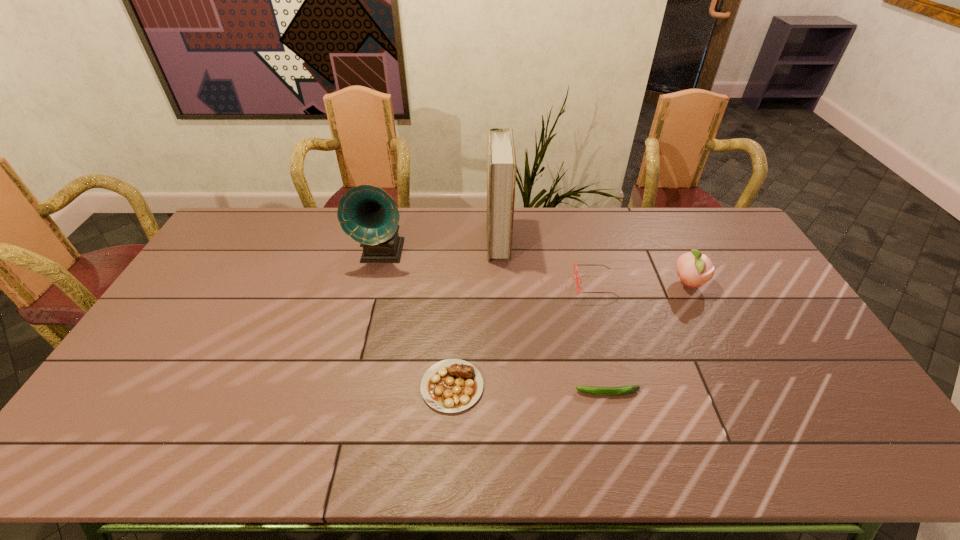
I want to click on vacant space located on the cover of the fourth object from right to left, so click(x=385, y=240).

Find the location of `blank area located on the cover of the fourth object from right to left`. blank area located on the cover of the fourth object from right to left is located at coordinates (407, 240).

At what (x,y) coordinates should I click in order to perform the action: click on blank space located 0.130m on the cover of the fourth object from right to left. Please return your answer as a coordinate pair (x, y). Looking at the image, I should click on point(451,240).

At what (x,y) coordinates should I click in order to perform the action: click on vacant space located 0.360m from the horn of the fifth shortest object. Please return your answer as a coordinate pair (x, y). The height and width of the screenshot is (540, 960). Looking at the image, I should click on (355, 362).

Locate an element on the screen. Image resolution: width=960 pixels, height=540 pixels. free space located on the left of the third tallest object is located at coordinates (602, 284).

Locate an element on the screen. The width and height of the screenshot is (960, 540). vacant space located on the front-facing side of the spectacles is located at coordinates (520, 285).

Identify the location of vacant space located on the front-facing side of the spectacles. The image size is (960, 540). coord(487,285).

Locate an element on the screen. vacant space located on the front-facing side of the spectacles is located at coordinates (492, 285).

What are the coordinates of `vacant space located 0.400m on the right of the second object from left to right` in the screenshot? It's located at (636, 386).

This screenshot has height=540, width=960. What are the coordinates of `vacant region located on the front-facing side of the shortest object` in the screenshot? It's located at (491, 393).